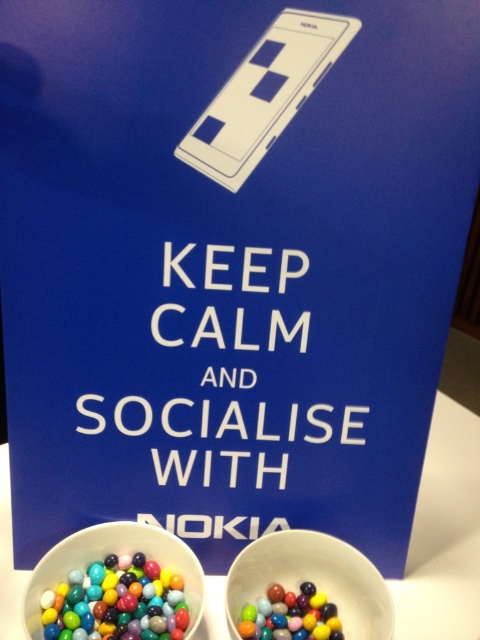
Question: Estimate the real-world distances between objects in this image. Which object is farther from the whitematerial/texturetext at center?

Choices:
 (A) glossy plastic candy at lower center
 (B) white glossy bowls at lower center
 (C) glossy plastic candies at lower left
 (D) matte ceramic bowl at lower center

Answer: (A)

Question: Is whitematerial/texturetext at center to the right of glossy plastic candy at lower center from the viewer's perspective?

Choices:
 (A) yes
 (B) no

Answer: (B)

Question: Is whitematerial/texturetext at center to the left of white glossy bowls at lower center from the viewer's perspective?

Choices:
 (A) no
 (B) yes

Answer: (B)

Question: Which object appears closest to the camera in this image?

Choices:
 (A) whitematerial/texturetext at center
 (B) white glossy bowls at lower center
 (C) glossy plastic candies at lower left

Answer: (C)

Question: Does whitematerial/texturetext at center lie behind glossy plastic candy at lower center?

Choices:
 (A) no
 (B) yes

Answer: (A)

Question: Which object is closer to the camera taking this photo?

Choices:
 (A) glossy plastic candies at lower left
 (B) white glossy bowls at lower center
 (C) whitematerial/texturetext at center

Answer: (A)